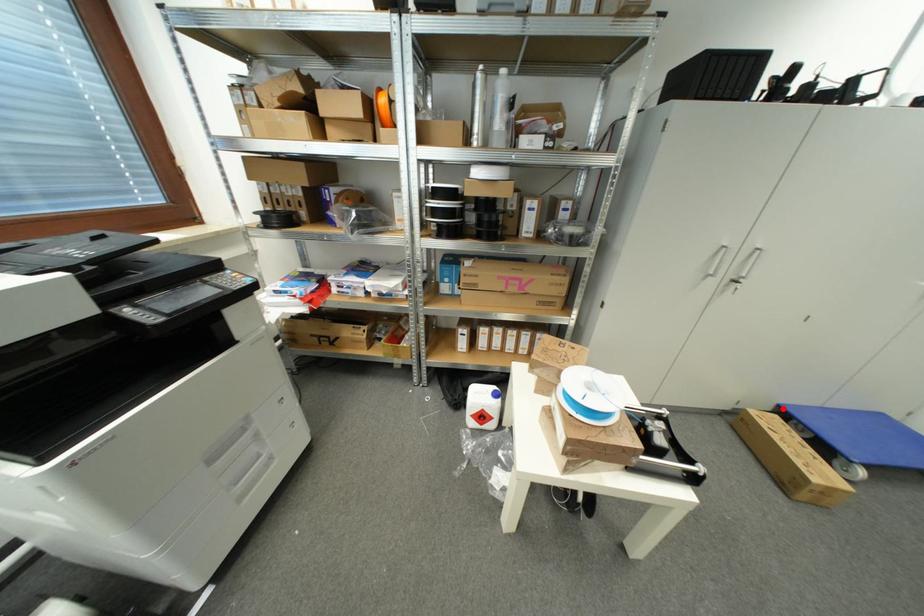
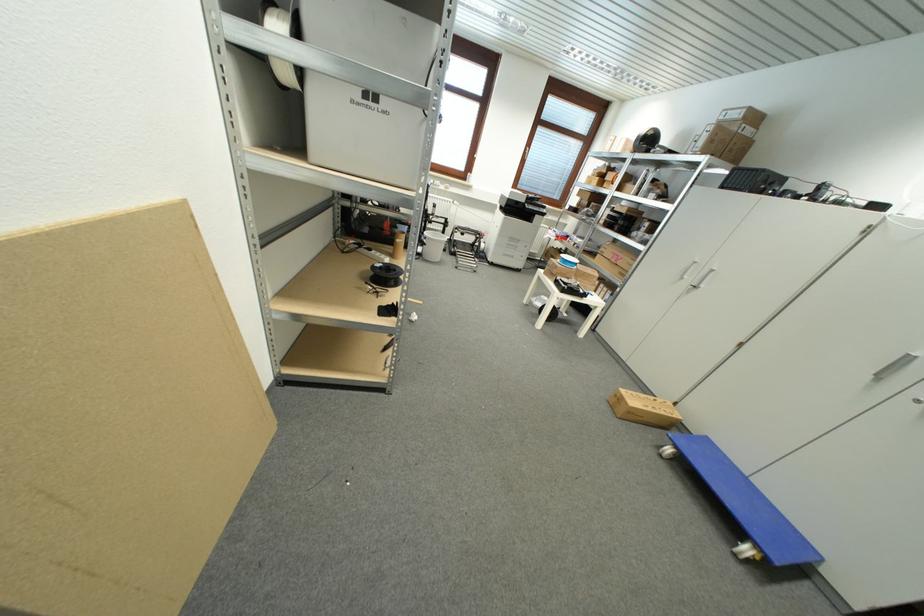
Where in the second image is the point corresponding to the highlighted location from the first image?

(711, 440)